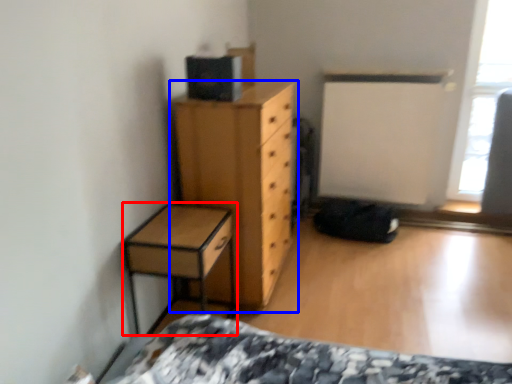
Question: Among these objects, which one is nearest to the camera, nightstand (highlighted by a red box) or chest of drawers (highlighted by a blue box)?

Choices:
 (A) nightstand
 (B) chest of drawers

Answer: (A)